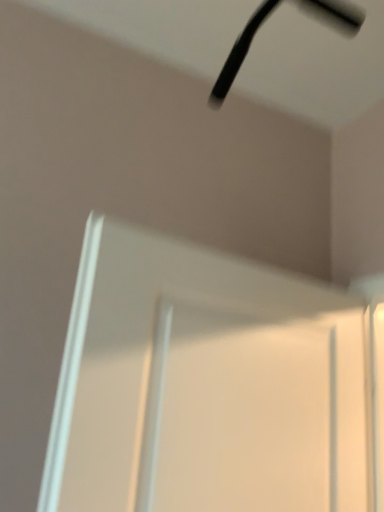
Where is `black matte lamp at upper center`? black matte lamp at upper center is located at coordinates (240, 52).

What is the approximate width of black matte lamp at upper center?

13.34 inches.

Describe the element at coordinates (240, 52) in the screenshot. I see `black matte lamp at upper center` at that location.

You are a GUI agent. You are given a task and a screenshot of the screen. Output one action in this format:
    pyautogui.click(x=<x>, y=<y>)
    Task: Click on the black matte lamp at upper center
    The width and height of the screenshot is (384, 512).
    Given the screenshot: What is the action you would take?
    pyautogui.click(x=240, y=52)